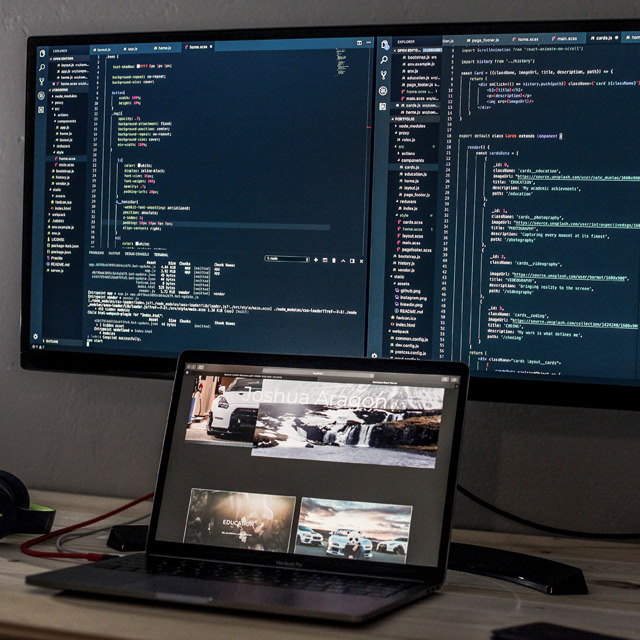
This screenshot has width=640, height=640. I want to click on monitor, so click(352, 148).